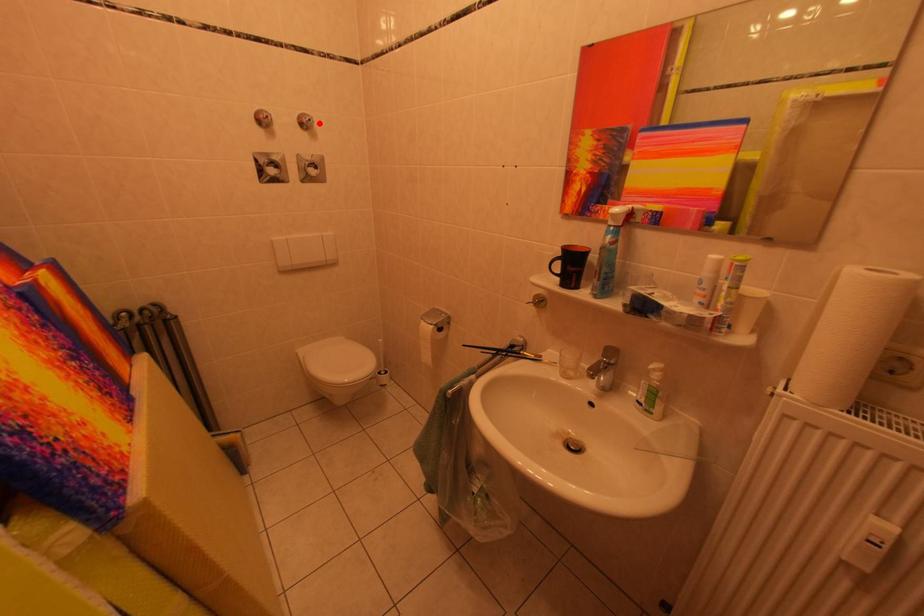
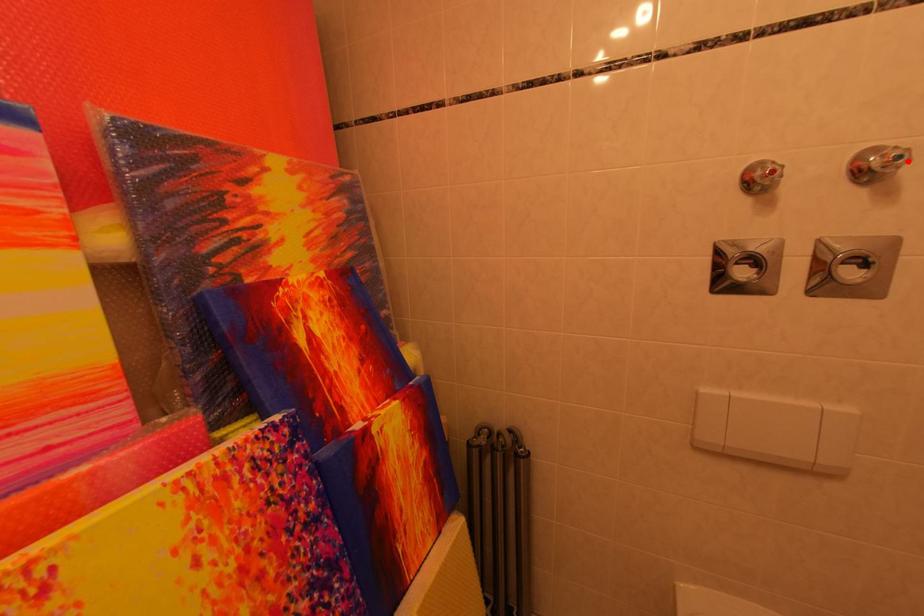
I am providing you with two images of the same scene from different viewpoints. A red point is marked on the first image and another point is marked on the second image. Is the red point in image1 aligned with the point shown in image2?

Yes